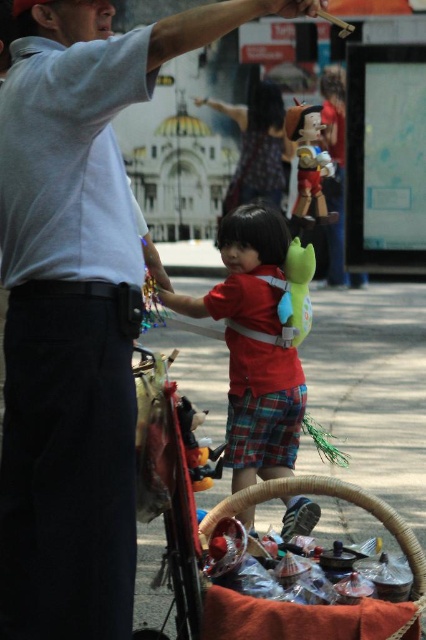
You are a delivery person who needs to place a package in the woven brown basket at lower center. The package is 1 meter tall. Can you place it in the basket without moving the matte red shirt at center?

The woven brown basket at lower center is behind the matte red shirt at center, so you cannot place the package in the basket without moving the matte red shirt at center because the basket is currently blocked by the shirt.

You are a delivery person trying to place a package that is 15 cm tall. You have two options in the image, the woven brown basket at lower center and the shiny red plastic toy at center. Which one can the package fit into vertically?

The woven brown basket at lower center is not as tall as the shiny red plastic toy at center. Since the package is 15 cm tall, it can fit into the shiny red plastic toy at center because it is taller than the basket.

You are a photographer trying to capture the perfect shot of the matte red shirt at center. The camera has a focal length of 50mm and an aperture of f2.8. Given the shirt is at coordinates point 0.542, 0.596, what adjustments should you make to ensure the shirt is in the center of the frame?

The matte red shirt at center is already positioned at point (253, 346), so no adjustments are needed as it is already centered in the frame.